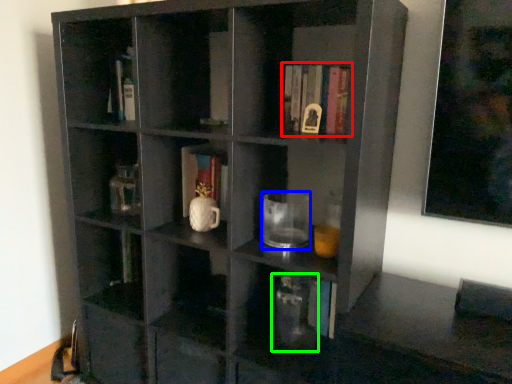
Question: Which object is positioned farthest from book (highlighted by a red box)? Select from mug (highlighted by a blue box) and glass vase (highlighted by a green box).

Choices:
 (A) mug
 (B) glass vase

Answer: (B)